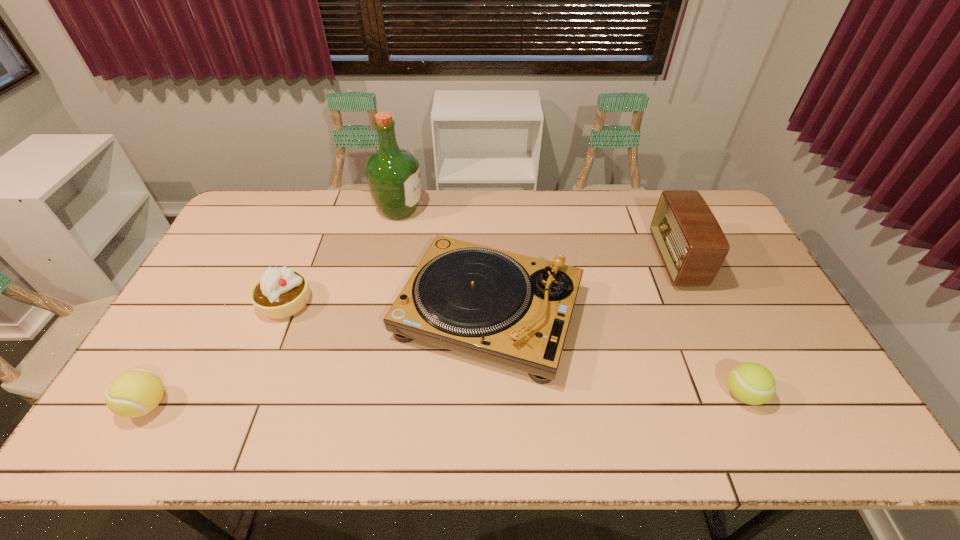
Identify the location of free space between the right tennis ball and the fifth shortest object. The width and height of the screenshot is (960, 540). point(709,327).

At what (x,y) coordinates should I click in order to perform the action: click on vacant area that lies between the farthest object and the radio receiver. Please return your answer as a coordinate pair (x, y). Looking at the image, I should click on (538, 235).

I want to click on free spot between the third tallest object and the second object from left to right, so click(387, 308).

Select which object is the second closest to the record player. Please provide its 2D coordinates. Your answer should be formatted as a tuple, i.e. [(x, y)], where the tuple contains the x and y coordinates of a point satisfying the conditions above.

[(279, 293)]

Find the location of a particular element. The height and width of the screenshot is (540, 960). object that ranks as the third closest to the right tennis ball is located at coordinates (393, 175).

Locate an element on the screen. This screenshot has width=960, height=540. vacant region that satisfies the following two spatial constraints: 1. on the front side of the whipped cream; 2. on the right side of the right tennis ball is located at coordinates (249, 394).

I want to click on free location that satisfies the following two spatial constraints: 1. on the front-facing side of the farthest object; 2. on the right side of the third tallest object, so click(377, 313).